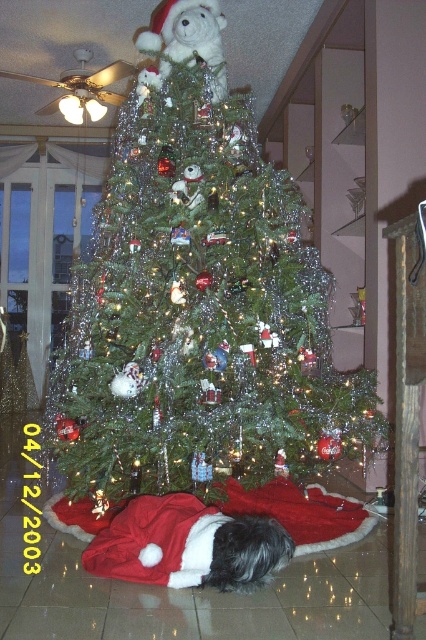
Is white soft dog at lower center bigger than white plush santa at upper center?

No, white soft dog at lower center is not bigger than white plush santa at upper center.

Between white soft dog at lower center and white plush santa at upper center, which one is positioned lower?

Positioned lower is white soft dog at lower center.

Between point (279, 541) and point (201, 44), which one is positioned in front?

Point (279, 541)

Where is `white soft dog at lower center`? white soft dog at lower center is located at coordinates (187, 545).

Which of these two, shiny metallic tree at center or white soft dog at lower center, stands shorter?

white soft dog at lower center is shorter.

Does point (163, 193) lie behind point (187, 538)?

Yes.

Where is `shiny metallic tree at center`? This screenshot has height=640, width=426. shiny metallic tree at center is located at coordinates (198, 300).

Does shiny metallic tree at center have a greater width compared to white plush santa at upper center?

Indeed, shiny metallic tree at center has a greater width compared to white plush santa at upper center.

Is shiny metallic tree at center below white plush santa at upper center?

Yes, shiny metallic tree at center is below white plush santa at upper center.

Is point (71, 288) farther from viewer compared to point (181, 28)?

Yes, it is behind point (181, 28).

Locate an element on the screen. This screenshot has width=426, height=640. shiny metallic tree at center is located at coordinates (198, 300).